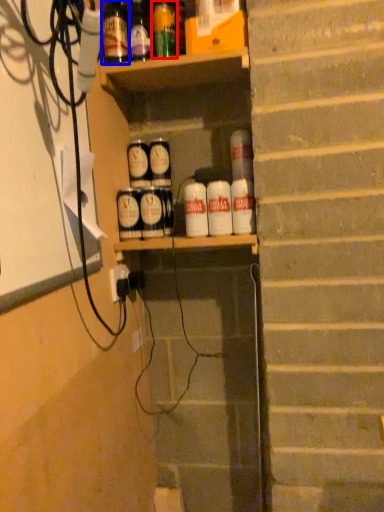
Question: Which object appears farthest to the camera in this image, bottle (highlighted by a red box) or bottle (highlighted by a blue box)?

Choices:
 (A) bottle
 (B) bottle

Answer: (A)